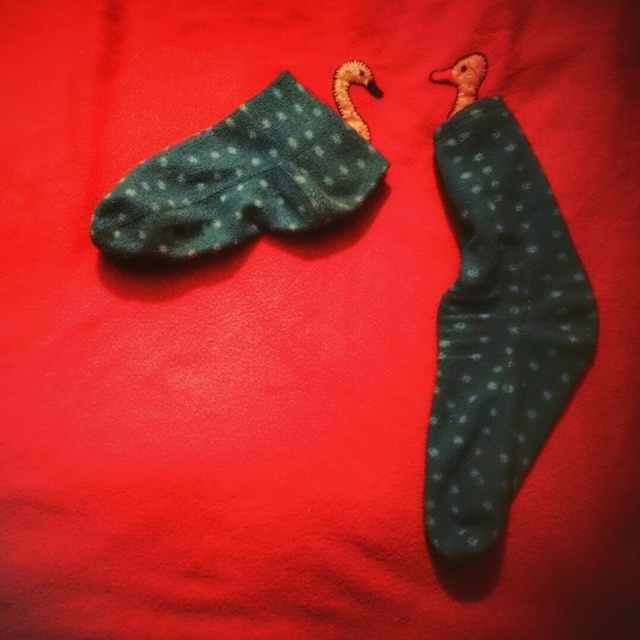
Can you confirm if dark green dotted sock at upper right is positioned above dark green fuzzy socks at upper left?

No.

Is point (531, 336) positioned before point (118, 200)?

No, it is not.

Identify the location of dark green dotted sock at upper right. (499, 328).